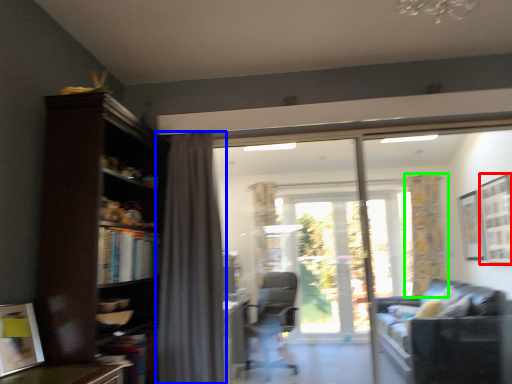
Question: Which object is positioned farthest from window (highlighted by a red box)? Select from curtain (highlighted by a blue box) and curtain (highlighted by a green box).

Choices:
 (A) curtain
 (B) curtain

Answer: (A)